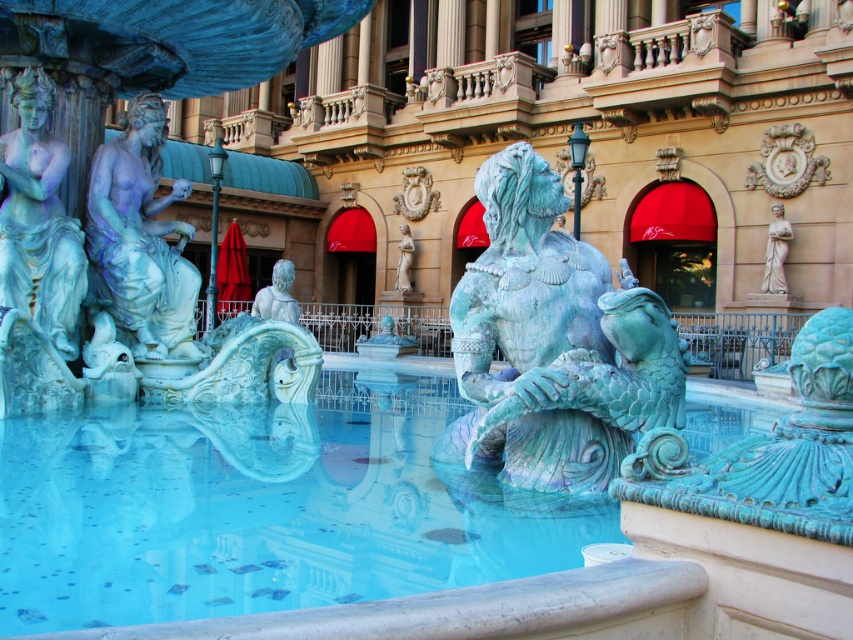
You are a tour guide leading a group to the entrance of the building behind the fountain. You need to walk around the fountain to reach the entrance. The path you take must go between the green patina sculpture at center and the white marble statue at center. Is the path wide enough for your group to pass through comfortably if the group requires a minimum of 100 feet of space?

The distance between the green patina sculpture at center and the white marble statue at center is 101.52 feet, which is more than the required 100 feet. Therefore, the path is wide enough for the group to pass through comfortably.

You are standing in front of the grand fountain. You want to take a photo of the point at coordinates point (386, 408). If your camera has a maximum focus range of 15 meters, will you be able to focus on that point?

The distance of point (386, 408) from camera is 16.88 meters, which exceeds the camera maximum focus range of 15 meters. So you cannot focus on that point.